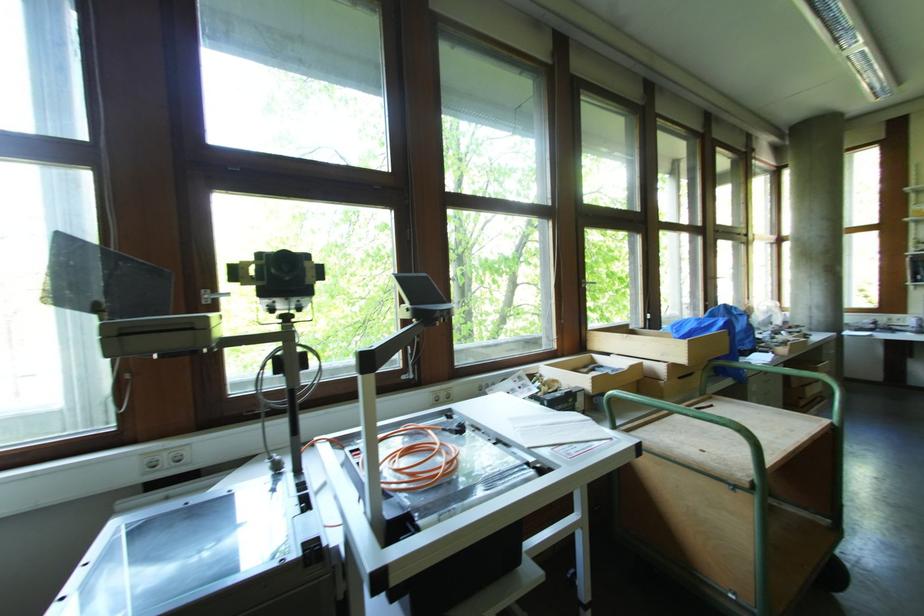
Where is `silver window handle`? This screenshot has width=924, height=616. silver window handle is located at coordinates (590, 284).